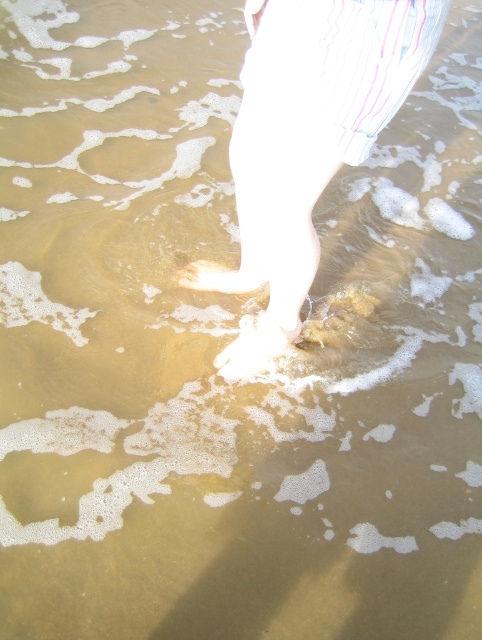
Question: Where is white cotton leg at center located in relation to white matte sand at center in the image?

Choices:
 (A) below
 (B) above

Answer: (B)

Question: Can you confirm if white cotton leg at center is positioned above white matte sand at center?

Choices:
 (A) yes
 (B) no

Answer: (A)

Question: Does white cotton leg at center appear over white matte sand at center?

Choices:
 (A) yes
 (B) no

Answer: (A)

Question: Which point is closer to the camera?

Choices:
 (A) (251, 285)
 (B) (262, 365)
 (C) (257, 35)

Answer: (C)

Question: Which is farther from the white matte foot at center?

Choices:
 (A) white cotton leg at center
 (B) white matte sand at center

Answer: (A)

Question: Which object is the closest to the white matte sand at center?

Choices:
 (A) white matte foot at center
 (B) white cotton leg at center

Answer: (A)